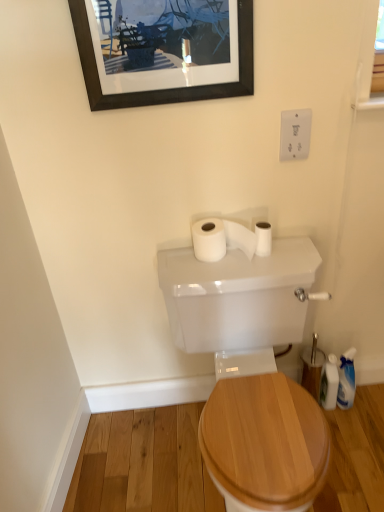
Identify the location of vacant space in front of white matte toilet paper at upper center, which appears as the first toilet paper when viewed from the left. (226, 271).